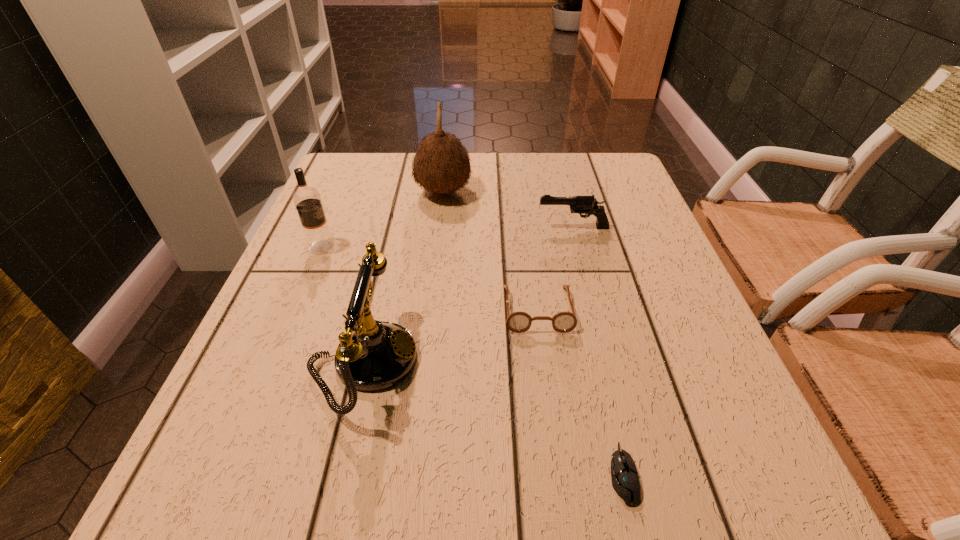
At what (x,y) coordinates should I click in order to perform the action: click on vacant space that's between the computer mouse and the second shortest object. Please return your answer as a coordinate pair (x, y). Looking at the image, I should click on (580, 392).

Locate an element on the screen. This screenshot has height=540, width=960. vacant space that is in between the gun and the coconut is located at coordinates (508, 210).

What are the coordinates of `free space between the computer mouse and the vodka` in the screenshot? It's located at (472, 360).

Identify the location of vacant area between the fourth tallest object and the telephone. This screenshot has height=540, width=960. tap(469, 295).

At what (x,y) coordinates should I click in order to perform the action: click on vacant space that is in between the gun and the third farthest object. Please return your answer as a coordinate pair (x, y). The height and width of the screenshot is (540, 960). Looking at the image, I should click on (447, 237).

Where is `free space that is in between the third shortest object and the spectacles`? free space that is in between the third shortest object and the spectacles is located at coordinates 555,268.

Locate an element on the screen. The width and height of the screenshot is (960, 540). free space between the coconut and the gun is located at coordinates point(508,210).

The image size is (960, 540). I want to click on empty space that is in between the third farthest object and the farthest object, so click(x=382, y=219).

You are a GUI agent. You are given a task and a screenshot of the screen. Output one action in this format:
    pyautogui.click(x=<x>, y=<y>)
    Task: Click on the free space between the fifth nearest object and the second shortest object
    The width and height of the screenshot is (960, 540).
    Given the screenshot: What is the action you would take?
    (555, 268)

Select which object is the second closest to the telephone. Please provide its 2D coordinates. Your answer should be formatted as a tuple, i.e. [(x, y)], where the tuple contains the x and y coordinates of a point satisfying the conditions above.

[(307, 200)]